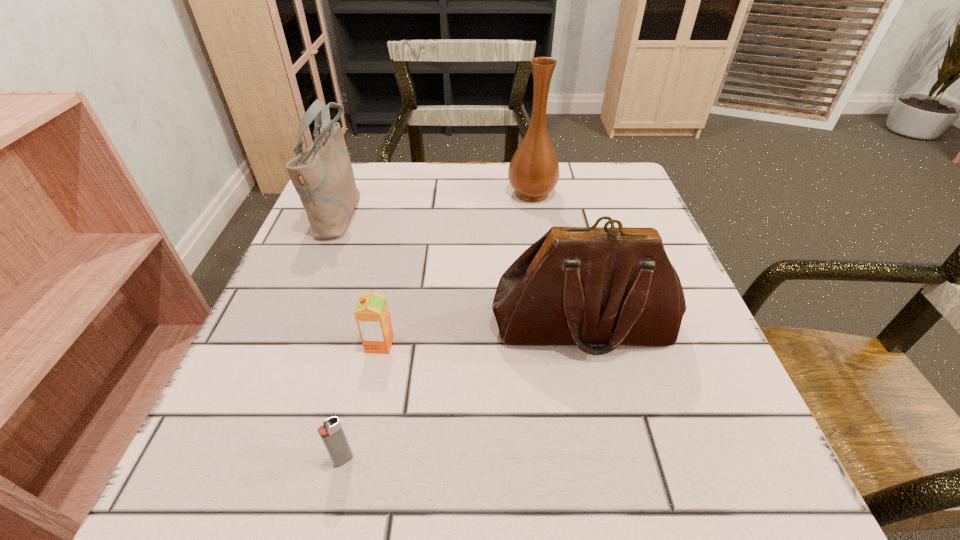
The width and height of the screenshot is (960, 540). Find the location of `vase`. vase is located at coordinates (533, 172).

The image size is (960, 540). Find the location of `the leftmost object`. the leftmost object is located at coordinates (322, 175).

You are a GUI agent. You are given a task and a screenshot of the screen. Output one action in this format:
    pyautogui.click(x=<x>, y=<y>)
    Task: Click on the left shoulder bag
    
    Given the screenshot: What is the action you would take?
    pyautogui.click(x=322, y=175)

This screenshot has width=960, height=540. What are the coordinates of `the nearer shoulder bag` in the screenshot? It's located at (584, 286).

This screenshot has width=960, height=540. Identify the location of the fourth tallest object. (372, 315).

Where is `the shortest object`? the shortest object is located at coordinates (331, 432).

You are a GUI agent. You are given a task and a screenshot of the screen. Output one action in this format:
    pyautogui.click(x=<x>, y=<y>)
    Task: Click on the igniter
    This screenshot has width=960, height=540.
    Given the screenshot: What is the action you would take?
    pyautogui.click(x=331, y=432)

Where is `free space located 0.100m on the front of the vase`? free space located 0.100m on the front of the vase is located at coordinates (539, 234).

Locate an element on the screen. vacant region located 0.240m on the front-facing side of the farther shoulder bag is located at coordinates (467, 212).

Locate an element on the screen. vacant space located 0.200m on the left of the right shoulder bag is located at coordinates (374, 326).